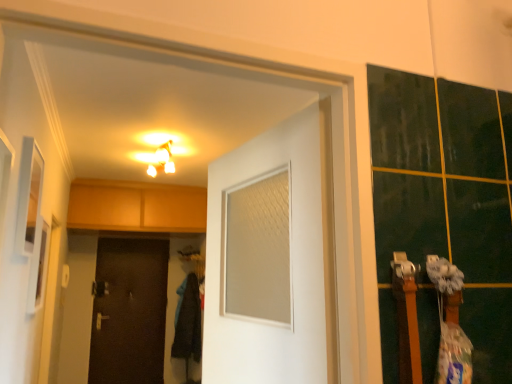
Question: Is white matte door at center, which is the 2th door in back-to-front order, spatially inside matte white light fixture at upper center, or outside of it?

Choices:
 (A) outside
 (B) inside

Answer: (A)

Question: Is white matte door at center, the first door from the right, taller or shorter than matte white light fixture at upper center?

Choices:
 (A) short
 (B) tall

Answer: (B)

Question: Which object is positioned closest to the matte white light fixture at upper center?

Choices:
 (A) white matte door at center, which is the 2th door in back-to-front order
 (B) brown matte door at lower left, the second door in the right-to-left sequence

Answer: (B)

Question: Which object is the farthest from the brown matte door at lower left, the 1th door positioned from the bottom?

Choices:
 (A) matte white light fixture at upper center
 (B) white matte door at center, which appears as the 2th door when ordered from the bottom

Answer: (B)